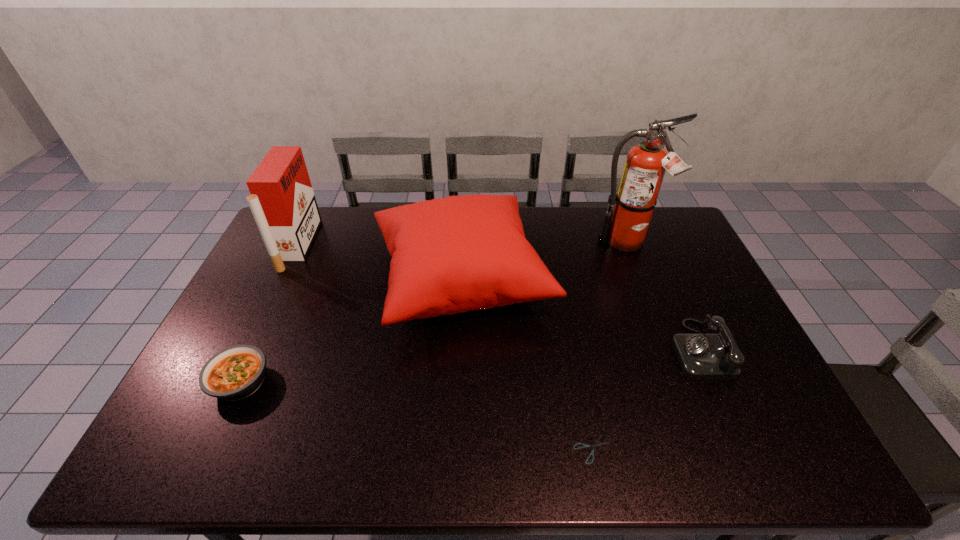
Where is `vacant region located 0.350m on the dial of the third shortest object`? The height and width of the screenshot is (540, 960). vacant region located 0.350m on the dial of the third shortest object is located at coordinates (548, 349).

Image resolution: width=960 pixels, height=540 pixels. What are the coordinates of `free space located on the dial of the third shortest object` in the screenshot? It's located at (648, 349).

Where is `vacant point located on the dial of the third shortest object`? vacant point located on the dial of the third shortest object is located at coordinates (630, 349).

Locate an element on the screen. This screenshot has height=540, width=960. vacant space located on the front of the stew is located at coordinates (209, 447).

Locate an element on the screen. vacant position located on the right of the shears is located at coordinates (636, 449).

Where is `fire extinguisher that is at the far edge`? This screenshot has width=960, height=540. fire extinguisher that is at the far edge is located at coordinates (625, 228).

The width and height of the screenshot is (960, 540). Find the location of `cigarette case that is at the far edge`. cigarette case that is at the far edge is located at coordinates (282, 201).

Locate an element on the screen. cushion that is at the far edge is located at coordinates (450, 255).

Where is `object present at the near edge`? This screenshot has height=540, width=960. object present at the near edge is located at coordinates (596, 444).

Identify the location of cigarette case present at the left edge. (282, 201).